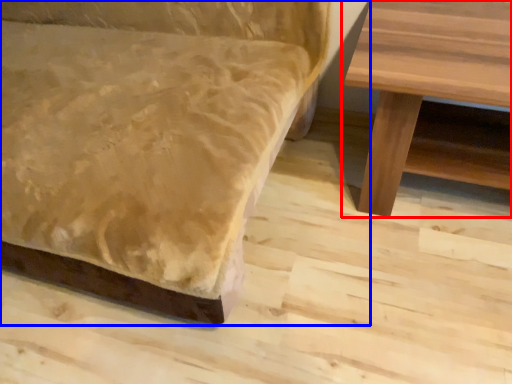
Question: Which of the following is the farthest to the observer, table (highlighted by a red box) or studio couch (highlighted by a blue box)?

Choices:
 (A) table
 (B) studio couch

Answer: (A)